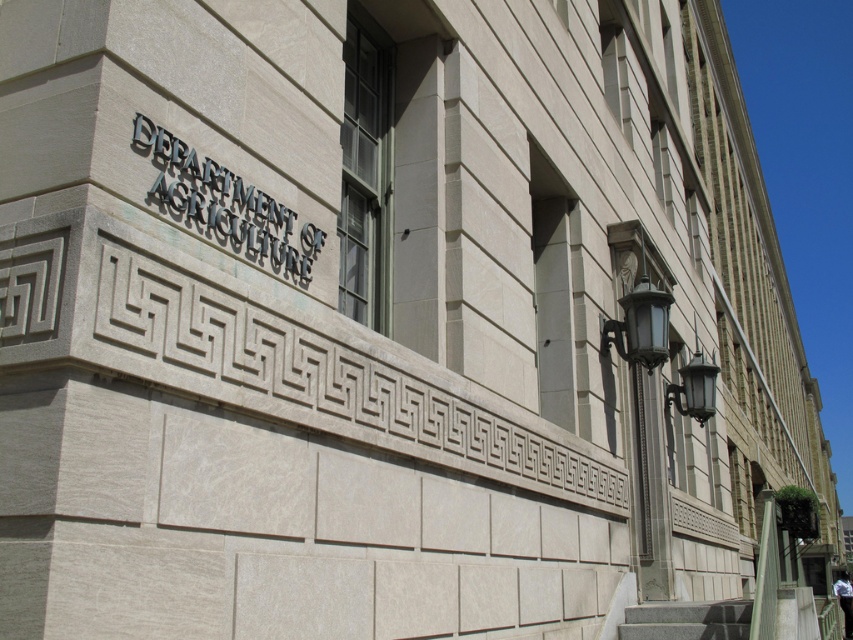
Can you confirm if black polished metal sign at upper center is wider than gray granite stairs at lower right?

In fact, black polished metal sign at upper center might be narrower than gray granite stairs at lower right.

Who is shorter, black polished metal sign at upper center or gray granite stairs at lower right?

gray granite stairs at lower right

Between point (315, 241) and point (640, 611), which one is positioned behind?

Positioned behind is point (640, 611).

The height and width of the screenshot is (640, 853). I want to click on black polished metal sign at upper center, so (x=225, y=204).